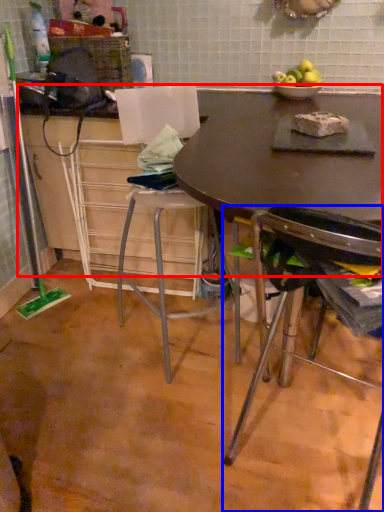
Question: Which object is further to the camera taking this photo, counter top (highlighted by a red box) or chair (highlighted by a blue box)?

Choices:
 (A) counter top
 (B) chair

Answer: (A)